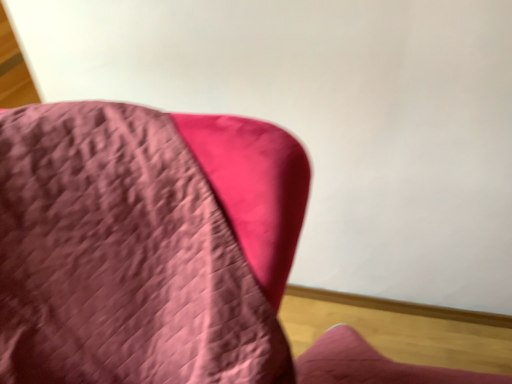
What do you see at coordinates (160, 253) in the screenshot? I see `velvet-like pink cushion at center` at bounding box center [160, 253].

The image size is (512, 384). I want to click on velvet-like pink cushion at center, so click(160, 253).

The width and height of the screenshot is (512, 384). What are the coordinates of `velvet-like pink cushion at center` in the screenshot? It's located at (160, 253).